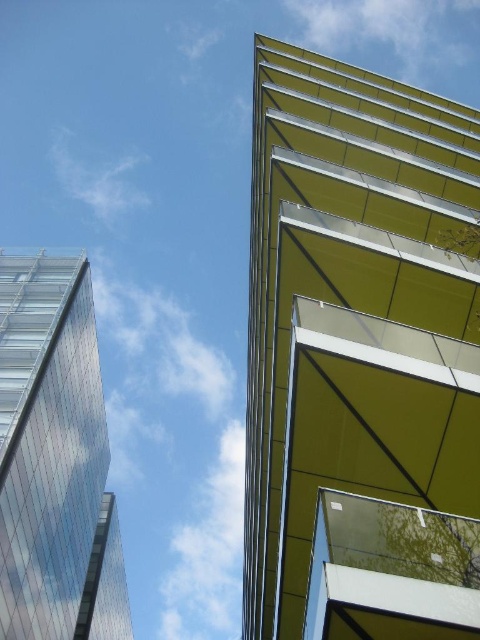
Question: Among these objects, which one is farthest from the camera?

Choices:
 (A) transparent glass building at left
 (B) yellow glass building at upper right

Answer: (A)

Question: Does yellow glass building at upper right have a smaller size compared to transparent glass building at left?

Choices:
 (A) yes
 (B) no

Answer: (B)

Question: Considering the relative positions of yellow glass building at upper right and transparent glass building at left in the image provided, where is yellow glass building at upper right located with respect to transparent glass building at left?

Choices:
 (A) right
 (B) left

Answer: (A)

Question: Is yellow glass building at upper right positioned before transparent glass building at left?

Choices:
 (A) no
 (B) yes

Answer: (B)